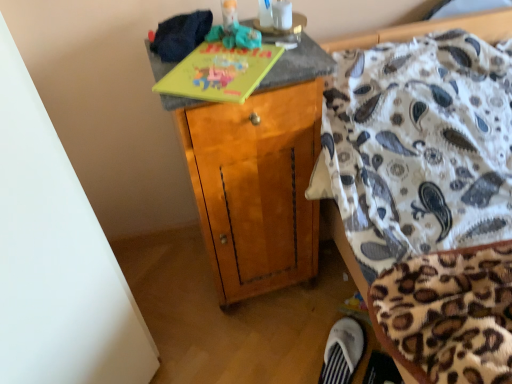
Question: Is yellow matte book at upper center wider or thinner than wooden cabinet at center?

Choices:
 (A) thin
 (B) wide

Answer: (A)

Question: Is yellow matte book at upper center bigger or smaller than wooden cabinet at center?

Choices:
 (A) big
 (B) small

Answer: (B)

Question: Based on their relative distances, which object is farther from the wooden cabinet at center?

Choices:
 (A) yellow matte book at upper center
 (B) white fabric slipper at lower right
 (C) rubberized green toy at upper center

Answer: (B)

Question: Estimate the real-world distances between objects in this image. Which object is farther from the white fabric slipper at lower right?

Choices:
 (A) rubberized green toy at upper center
 (B) wooden cabinet at center
 (C) yellow matte book at upper center

Answer: (A)